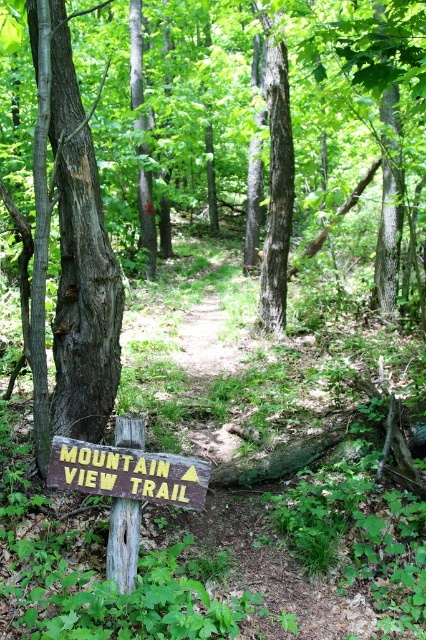
Question: Considering the relative positions of brown wooden sign at lower center and weathered brown signpost at lower left in the image provided, where is brown wooden sign at lower center located with respect to weathered brown signpost at lower left?

Choices:
 (A) above
 (B) below

Answer: (A)

Question: Does brown wooden sign at lower center come behind weathered brown signpost at lower left?

Choices:
 (A) no
 (B) yes

Answer: (A)

Question: Does brown wooden sign at lower center have a lesser width compared to weathered brown signpost at lower left?

Choices:
 (A) no
 (B) yes

Answer: (A)